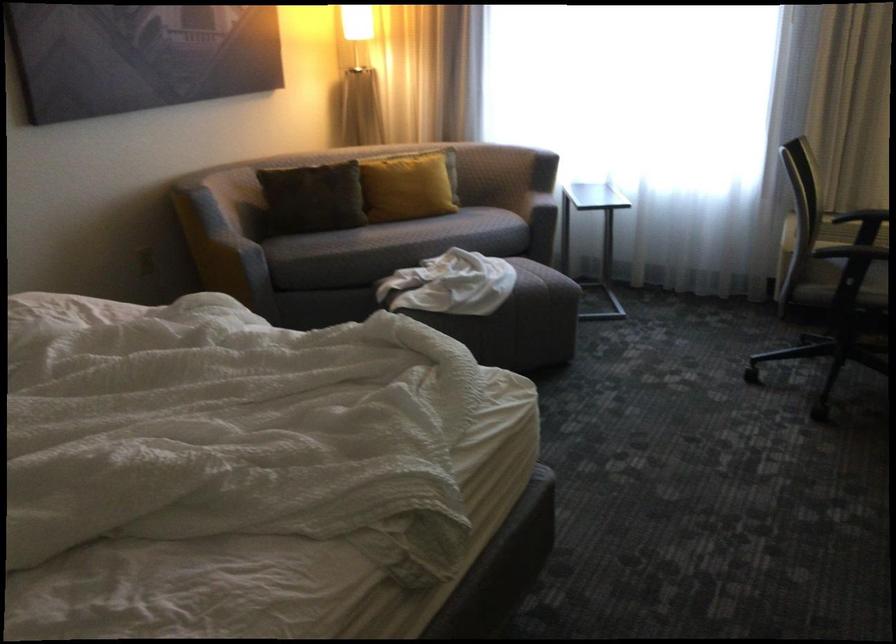
Where is `chair sitting surface`? chair sitting surface is located at coordinates (831, 294).